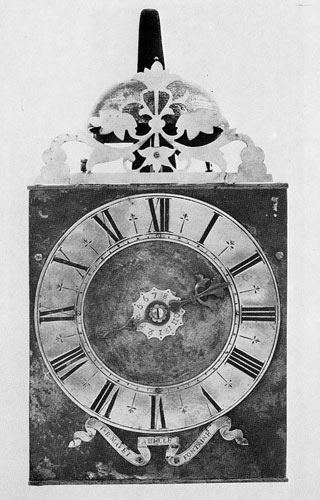
Locate an element on the screen. floral design on clock is located at coordinates (105, 155), (161, 90), (192, 128), (162, 165).